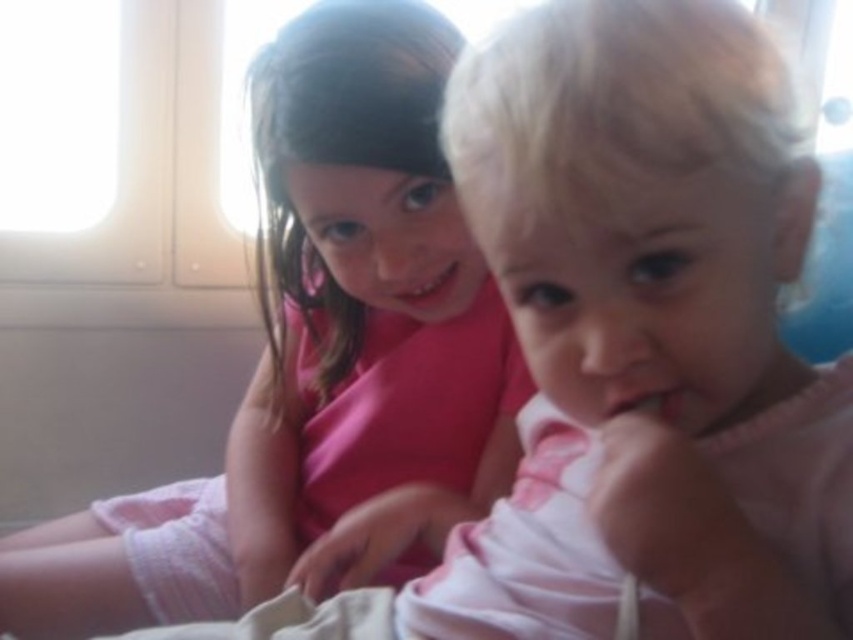
Question: Which object is farther from the camera taking this photo?

Choices:
 (A) matte pink mouth at center
 (B) pink matte shirt at upper left

Answer: (A)

Question: Does pink matte shirt at upper left have a larger size compared to matte pink mouth at center?

Choices:
 (A) yes
 (B) no

Answer: (A)

Question: Among these objects, which one is farthest from the camera?

Choices:
 (A) pink matte mouth at center
 (B) matte pink mouth at center

Answer: (B)

Question: Among these points, which one is farthest from the camera?

Choices:
 (A) (347, 276)
 (B) (434, 300)
 (C) (625, 406)

Answer: (B)

Question: Can you confirm if pink matte shirt at upper left is wider than pink matte mouth at center?

Choices:
 (A) no
 (B) yes

Answer: (B)

Question: Does pink matte shirt at upper left have a greater width compared to matte pink mouth at center?

Choices:
 (A) yes
 (B) no

Answer: (A)